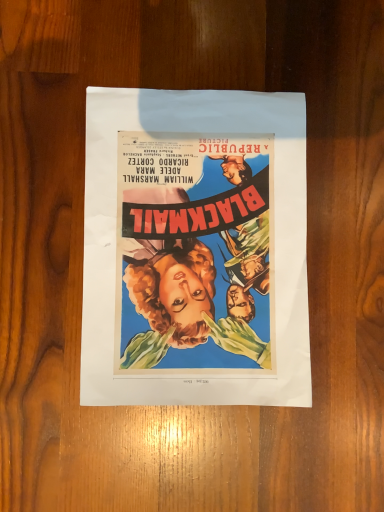
I want to click on free space above vibrant paper poster at center (from a real-world perspective), so click(x=189, y=239).